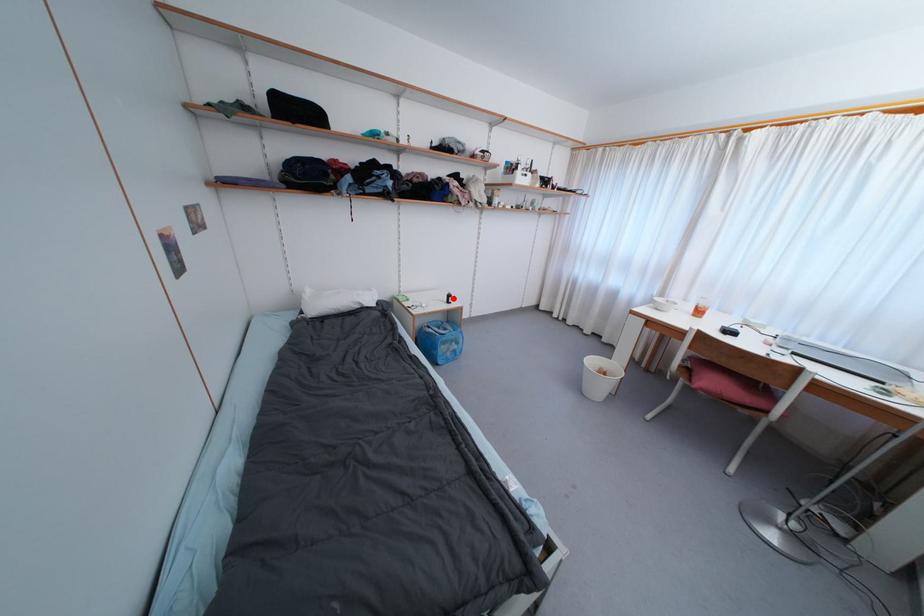
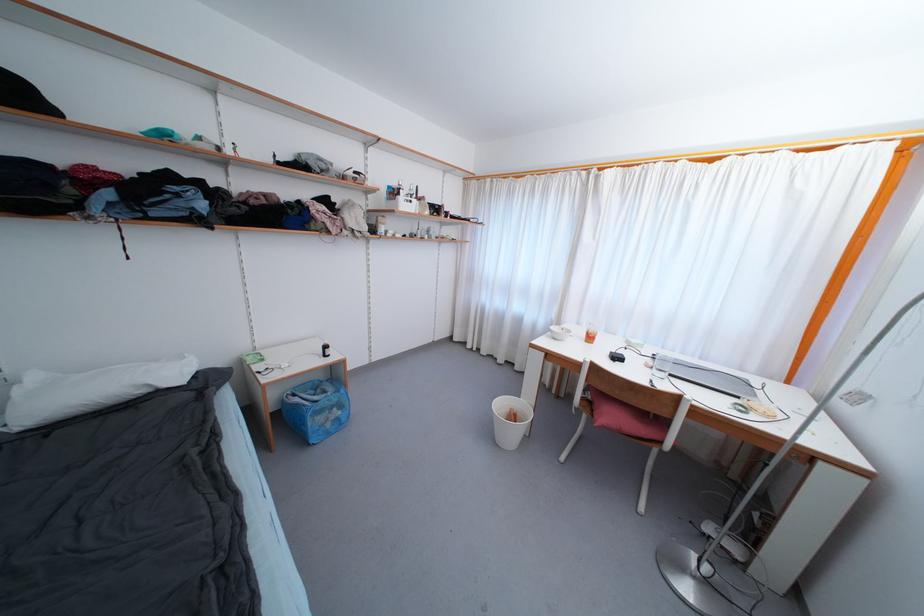
The point at the highlighted location is marked in the first image. Where is the corresponding point in the second image?

(330, 350)